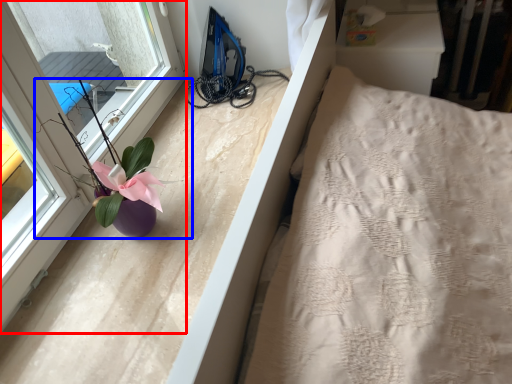
Question: Which object appears closest to the camera in this image, window (highlighted by a red box) or floral arrangement (highlighted by a blue box)?

Choices:
 (A) window
 (B) floral arrangement

Answer: (A)